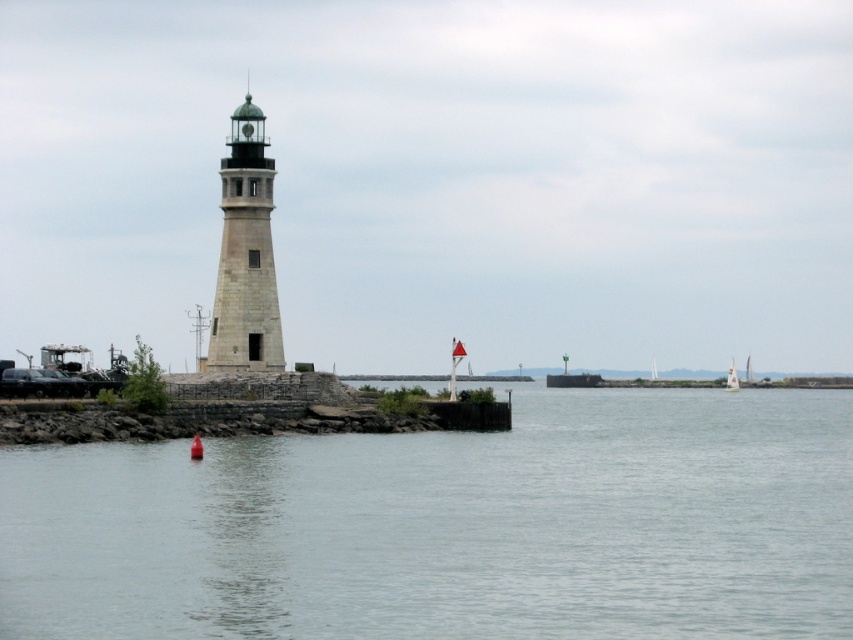
Image resolution: width=853 pixels, height=640 pixels. Find the location of `white stone lighthouse at left`. white stone lighthouse at left is located at coordinates (245, 256).

Can you confirm if white stone lighthouse at left is positioned above white sailboat at center?

Yes, white stone lighthouse at left is above white sailboat at center.

Is point (212, 330) farther from viewer compared to point (728, 372)?

No, (212, 330) is closer to viewer.

Where is `white stone lighthouse at left`? white stone lighthouse at left is located at coordinates (245, 256).

Can you confirm if clear water at center is thinner than white stone lighthouse at left?

Incorrect, clear water at center's width is not less than white stone lighthouse at left's.

Image resolution: width=853 pixels, height=640 pixels. Find the location of `clear water at center`. clear water at center is located at coordinates (450, 525).

Between point (669, 486) and point (734, 384), which one is positioned behind?

The point (734, 384) is behind.

Between clear water at center and white sailboat at center, which one appears on the left side from the viewer's perspective?

clear water at center

Is point (798, 508) positioned behind point (727, 372)?

No, (798, 508) is in front of (727, 372).

Where is `clear water at center`? The width and height of the screenshot is (853, 640). clear water at center is located at coordinates (450, 525).